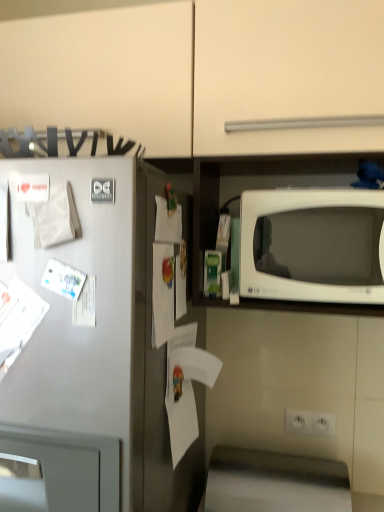
Question: Does white plastic electric outlet at lower center appear on the left side of white matte paper at center, the first paper from the top?

Choices:
 (A) no
 (B) yes

Answer: (A)

Question: Considering the relative positions of white plastic electric outlet at lower center and white matte paper at center, the 4th paper ordered from the bottom, in the image provided, is white plastic electric outlet at lower center to the right of white matte paper at center, the 4th paper ordered from the bottom, from the viewer's perspective?

Choices:
 (A) yes
 (B) no

Answer: (A)

Question: Is white plastic electric outlet at lower center facing towards white matte paper at center, the 4th paper ordered from the bottom?

Choices:
 (A) no
 (B) yes

Answer: (A)

Question: Is white plastic electric outlet at lower center thinner than white matte paper at center, the 2th paper viewed from the right?

Choices:
 (A) yes
 (B) no

Answer: (A)

Question: Does white plastic electric outlet at lower center have a greater height compared to white matte paper at center, the first paper from the top?

Choices:
 (A) no
 (B) yes

Answer: (A)

Question: Is white plastic electric outlet at lower center positioned far away from white matte paper at center, the first paper from the top?

Choices:
 (A) yes
 (B) no

Answer: (B)

Question: Considering the relative sizes of white matte paper at left, which ranks as the 2th paper in top-to-bottom order, and satin silver refrigerator at left in the image provided, is white matte paper at left, which ranks as the 2th paper in top-to-bottom order, thinner than satin silver refrigerator at left?

Choices:
 (A) yes
 (B) no

Answer: (A)

Question: Does white matte paper at left, which ranks as the 2th paper in top-to-bottom order, touch satin silver refrigerator at left?

Choices:
 (A) no
 (B) yes

Answer: (A)

Question: Can you confirm if white matte paper at left, which is the 3th paper from right to left, is taller than satin silver refrigerator at left?

Choices:
 (A) no
 (B) yes

Answer: (A)

Question: Is white matte paper at left, which is the 3th paper from right to left, wider than satin silver refrigerator at left?

Choices:
 (A) no
 (B) yes

Answer: (A)

Question: Can you confirm if white matte paper at left, which ranks as the 2th paper in top-to-bottom order, is bigger than satin silver refrigerator at left?

Choices:
 (A) yes
 (B) no

Answer: (B)

Question: From the image's perspective, would you say white matte paper at left, which ranks as the 2th paper in top-to-bottom order, is positioned over satin silver refrigerator at left?

Choices:
 (A) yes
 (B) no

Answer: (A)

Question: Is white glossy microwave at right thinner than white matte paper at left, the third paper ordered from the bottom?

Choices:
 (A) yes
 (B) no

Answer: (B)